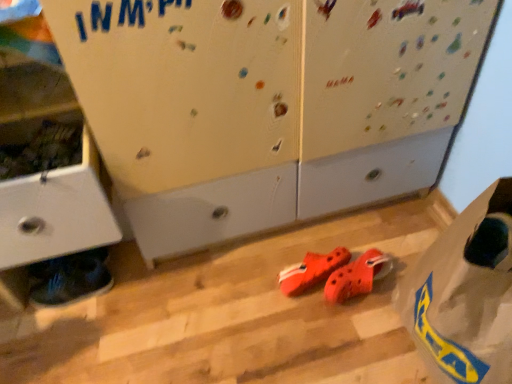
You are a GUI agent. You are given a task and a screenshot of the screen. Output one action in this format:
    pyautogui.click(x=<x>, y=<y>)
    Task: Click on the free point to the right of rubber/crocodile-patterned shoes at center, the 2th footwear positioned from the left
    The height and width of the screenshot is (384, 512).
    Given the screenshot: What is the action you would take?
    pyautogui.click(x=382, y=271)